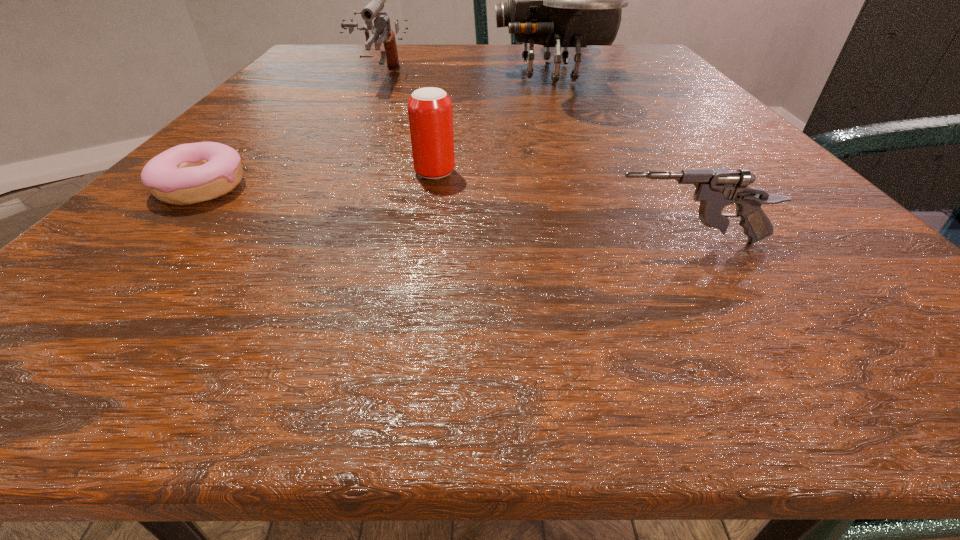
Identify the location of empty space between the second tallest object and the drone. This screenshot has height=540, width=960. (465, 76).

Where is `vacant region between the taller gun and the drone`? vacant region between the taller gun and the drone is located at coordinates (465, 76).

At what (x,y) coordinates should I click in order to perform the action: click on object that can be found as the fourth closest to the drone. Please return your answer as a coordinate pair (x, y). Looking at the image, I should click on tap(186, 174).

Select which object appears as the third closest to the right gun. Please provide its 2D coordinates. Your answer should be formatted as a tuple, i.e. [(x, y)], where the tuple contains the x and y coordinates of a point satisfying the conditions above.

[(186, 174)]

Find the location of a particular element. This screenshot has width=960, height=540. vacant area that satisfies the following two spatial constraints: 1. on the front-facing side of the tallest object; 2. at the barrel end of the farther gun is located at coordinates [x=552, y=78].

Locate an element on the screen. vacant space that satisfies the following two spatial constraints: 1. on the back side of the third tallest object; 2. on the right side of the doughnut is located at coordinates (216, 173).

Where is `vacant space that satisfies the following two spatial constraints: 1. on the front-facing side of the drone; 2. at the barrel end of the farther gun`? The width and height of the screenshot is (960, 540). vacant space that satisfies the following two spatial constraints: 1. on the front-facing side of the drone; 2. at the barrel end of the farther gun is located at coordinates (552, 78).

You are a GUI agent. You are given a task and a screenshot of the screen. Output one action in this format:
    pyautogui.click(x=<x>, y=<y>)
    Task: Click on the free space that satisfies the following two spatial constraints: 1. on the front-facing side of the drone; 2. on the front side of the doughnut
    This screenshot has width=960, height=540.
    Given the screenshot: What is the action you would take?
    pyautogui.click(x=594, y=188)

Where is `vacant position in the image that satisfies the following two spatial constraints: 1. on the front-facing side of the tallest object; 2. on the front side of the third shortest object`? The height and width of the screenshot is (540, 960). vacant position in the image that satisfies the following two spatial constraints: 1. on the front-facing side of the tallest object; 2. on the front side of the third shortest object is located at coordinates (588, 173).